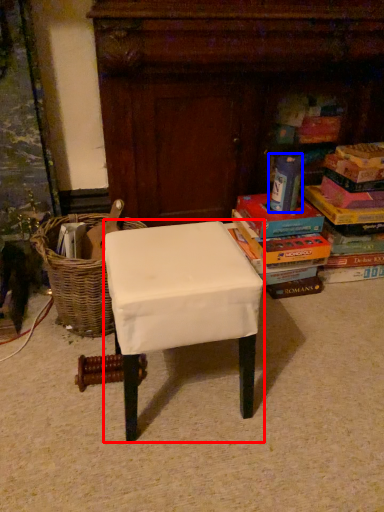
Question: Which object appears closest to the camera in this image, stool (highlighted by a red box) or paperback book (highlighted by a blue box)?

Choices:
 (A) stool
 (B) paperback book

Answer: (A)